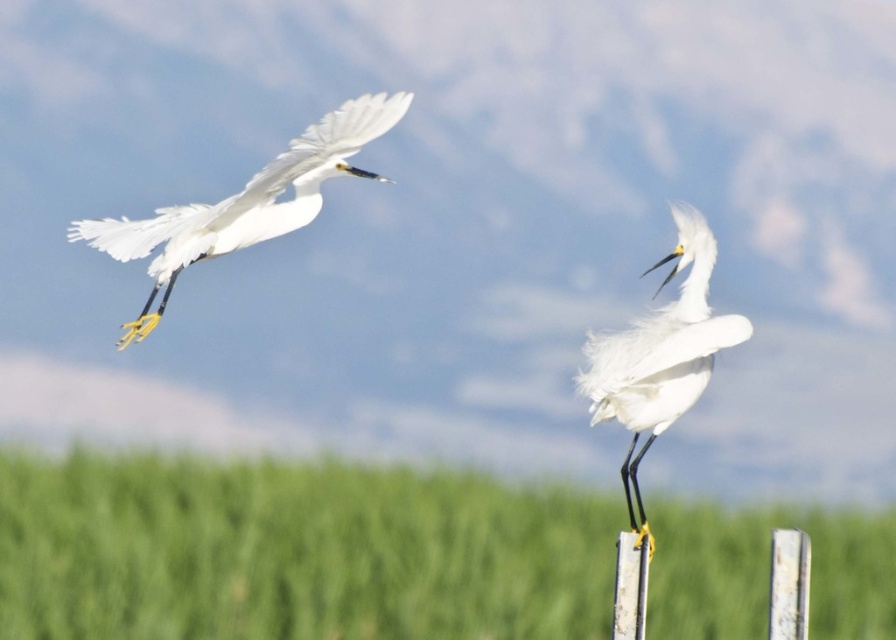
Question: Does white feathered bird at left have a greater width compared to white fluffy bird at center?

Choices:
 (A) no
 (B) yes

Answer: (B)

Question: Which object appears farthest from the camera in this image?

Choices:
 (A) white feathered bird at left
 (B) white fluffy bird at center

Answer: (A)

Question: Does white feathered bird at left appear on the right side of white fluffy bird at center?

Choices:
 (A) no
 (B) yes

Answer: (A)

Question: Which object is farther from the camera taking this photo?

Choices:
 (A) white fluffy bird at center
 (B) white feathered bird at left

Answer: (B)

Question: Is the position of white feathered bird at left less distant than that of white fluffy bird at center?

Choices:
 (A) yes
 (B) no

Answer: (B)